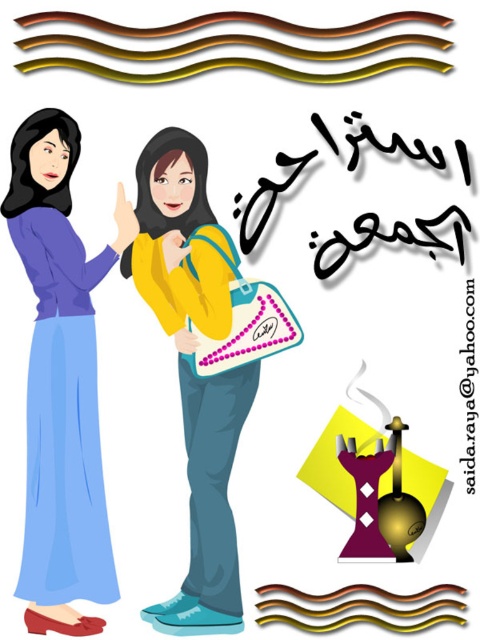
Question: Is white matte hand at center further to camera compared to matte yellow handbag at center?

Choices:
 (A) no
 (B) yes

Answer: (B)

Question: Which point is farther to the camera?

Choices:
 (A) (115, 204)
 (B) (178, 241)
 (C) (72, 401)

Answer: (A)

Question: Does matte purple dress at left appear under matte yellow handbag at center?

Choices:
 (A) no
 (B) yes

Answer: (B)

Question: Which object is closer to the camera taking this photo?

Choices:
 (A) matte purple dress at left
 (B) matte yellow handbag at center
 (C) matte blue handbag at center

Answer: (B)

Question: Estimate the real-world distances between objects in this image. Which object is closer to the matte yellow handbag at center?

Choices:
 (A) matte purple dress at left
 (B) yellow matte backpack at center
 (C) matte blue handbag at center

Answer: (C)

Question: Considering the relative positions of matte purple dress at left and white matte hand at center in the image provided, where is matte purple dress at left located with respect to white matte hand at center?

Choices:
 (A) below
 (B) above

Answer: (A)